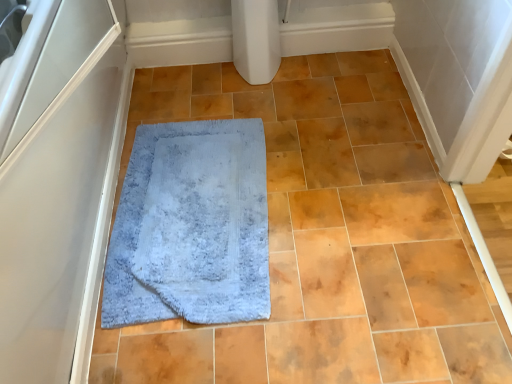
Identify the location of white matte screen door at left. (53, 182).

Is blue soft carpet at center bigger than white matte screen door at left?

No, blue soft carpet at center is not bigger than white matte screen door at left.

Consider the image. Considering the relative sizes of blue soft carpet at center and white matte screen door at left in the image provided, is blue soft carpet at center shorter than white matte screen door at left?

Correct, blue soft carpet at center is not as tall as white matte screen door at left.

Is blue soft carpet at center facing away from white matte screen door at left?

No, blue soft carpet at center is not facing away from white matte screen door at left.

Locate an element on the screen. The image size is (512, 384). ceramic tile located above the light blue shaggy rug at center (from a real-world perspective) is located at coordinates (327, 240).

Measure the distance from blue soft carpet at center to light blue shaggy rug at center.

The distance of blue soft carpet at center from light blue shaggy rug at center is 9.23 inches.

From a real-world perspective, is blue soft carpet at center on top of light blue shaggy rug at center?

Yes.

Would you say blue soft carpet at center is a long distance from light blue shaggy rug at center?

They are positioned close to each other.

In the scene shown: Can you confirm if light blue shaggy rug at center is bigger than white matte screen door at left?

No.

Which is closer to the camera, (123, 264) or (63, 32)?

Point (123, 264) is positioned farther from the camera compared to point (63, 32).

Is white matte screen door at left at the back of light blue shaggy rug at center?

No, light blue shaggy rug at center's orientation is not away from white matte screen door at left.

From the image's perspective, relative to blue soft carpet at center, is light blue shaggy rug at center above or below?

Clearly, from the image's perspective, light blue shaggy rug at center is below blue soft carpet at center.

The image size is (512, 384). Identify the location of bath mat located on the left of blue soft carpet at center. (191, 226).

Which is behind, point (149, 280) or point (366, 246)?

The point (366, 246) is farther.

From the picture: Which is more to the right, white matte screen door at left or blue soft carpet at center?

From the viewer's perspective, blue soft carpet at center appears more on the right side.

From a real-world perspective, is white matte screen door at left beneath blue soft carpet at center?

No, from a real-world perspective, white matte screen door at left is not under blue soft carpet at center.

Does white matte screen door at left have a smaller size compared to blue soft carpet at center?

Actually, white matte screen door at left might be larger than blue soft carpet at center.

Considering the sizes of white matte screen door at left and blue soft carpet at center in the image, is white matte screen door at left taller or shorter than blue soft carpet at center?

In the image, white matte screen door at left appears to be taller than blue soft carpet at center.

Is white matte screen door at left looking in the opposite direction of light blue shaggy rug at center?

No, white matte screen door at left is not facing away from light blue shaggy rug at center.

In the scene shown: Between white matte screen door at left and light blue shaggy rug at center, which one appears on the left side from the viewer's perspective?

white matte screen door at left is more to the left.

Is white matte screen door at left smaller than light blue shaggy rug at center?

No.

The height and width of the screenshot is (384, 512). Identify the location of screen door that appears on the left of blue soft carpet at center. (53, 182).

At what (x,y) coordinates should I click in order to perform the action: click on bath mat that appears behind the blue soft carpet at center. Please return your answer as a coordinate pair (x, y). The width and height of the screenshot is (512, 384). Looking at the image, I should click on (191, 226).

In the scene shown: Based on their spatial positions, is white matte screen door at left or light blue shaggy rug at center further from blue soft carpet at center?

white matte screen door at left lies further to blue soft carpet at center than the other object.

Estimate the real-world distances between objects in this image. Which object is closer to white matte screen door at left, blue soft carpet at center or light blue shaggy rug at center?

light blue shaggy rug at center is closer to white matte screen door at left.

Based on their spatial positions, is light blue shaggy rug at center or blue soft carpet at center further from white matte screen door at left?

Based on the image, blue soft carpet at center appears to be further to white matte screen door at left.

When comparing their distances from light blue shaggy rug at center, does blue soft carpet at center or white matte screen door at left seem further?

white matte screen door at left is further to light blue shaggy rug at center.

When comparing their distances from blue soft carpet at center, does light blue shaggy rug at center or white matte screen door at left seem closer?

The object closer to blue soft carpet at center is light blue shaggy rug at center.

From the image, which object appears to be farther from light blue shaggy rug at center, white matte screen door at left or blue soft carpet at center?

white matte screen door at left lies further to light blue shaggy rug at center than the other object.

Find the location of a particular element. The width and height of the screenshot is (512, 384). bath mat between white matte screen door at left and blue soft carpet at center from left to right is located at coordinates (191, 226).